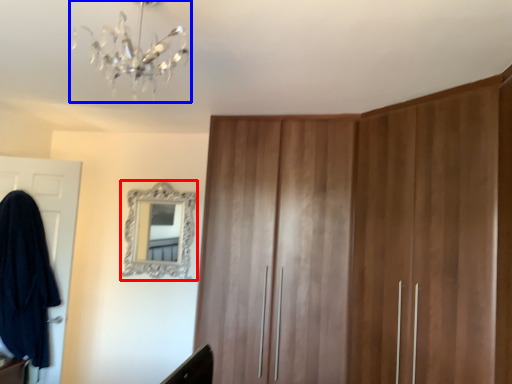
Question: Which of the following is the closest to the observer, mirror (highlighted by a red box) or light fixture (highlighted by a blue box)?

Choices:
 (A) mirror
 (B) light fixture

Answer: (B)